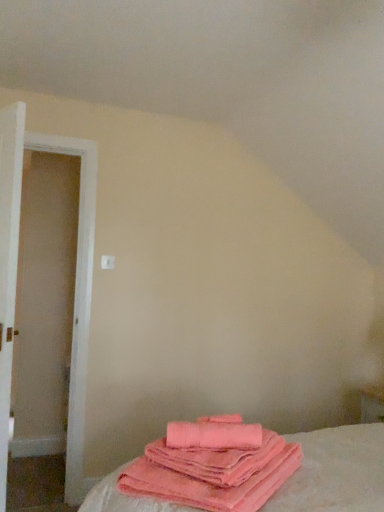
Question: Should I look upward or downward to see white wooden door at left?

Choices:
 (A) down
 (B) up

Answer: (A)

Question: From a real-world perspective, is pink soft cotton towels at lower center positioned over white wooden door at left based on gravity?

Choices:
 (A) yes
 (B) no

Answer: (B)

Question: Would you say pink soft cotton towels at lower center contains white wooden door at left?

Choices:
 (A) no
 (B) yes

Answer: (A)

Question: Are pink soft cotton towels at lower center and white wooden door at left making contact?

Choices:
 (A) no
 (B) yes

Answer: (A)

Question: Does pink soft cotton towels at lower center have a smaller size compared to white wooden door at left?

Choices:
 (A) no
 (B) yes

Answer: (B)

Question: Is pink soft cotton towels at lower center behind white wooden door at left?

Choices:
 (A) no
 (B) yes

Answer: (A)

Question: Does pink soft cotton towels at lower center have a larger size compared to white wooden door at left?

Choices:
 (A) yes
 (B) no

Answer: (B)

Question: Is pink plush towels at lower center turned away from white wooden door at left?

Choices:
 (A) no
 (B) yes

Answer: (A)

Question: Does pink plush towels at lower center appear on the left side of white wooden door at left?

Choices:
 (A) yes
 (B) no

Answer: (B)

Question: From the image's perspective, does pink plush towels at lower center appear higher than white wooden door at left?

Choices:
 (A) no
 (B) yes

Answer: (A)

Question: Is pink plush towels at lower center shorter than white wooden door at left?

Choices:
 (A) no
 (B) yes

Answer: (B)

Question: Are pink plush towels at lower center and white wooden door at left making contact?

Choices:
 (A) no
 (B) yes

Answer: (A)

Question: Considering the relative positions of pink plush towels at lower center and white wooden door at left in the image provided, is pink plush towels at lower center in front of white wooden door at left?

Choices:
 (A) no
 (B) yes

Answer: (B)

Question: Is the position of pink soft cotton towels at lower center less distant than that of pink plush towels at lower center?

Choices:
 (A) yes
 (B) no

Answer: (B)